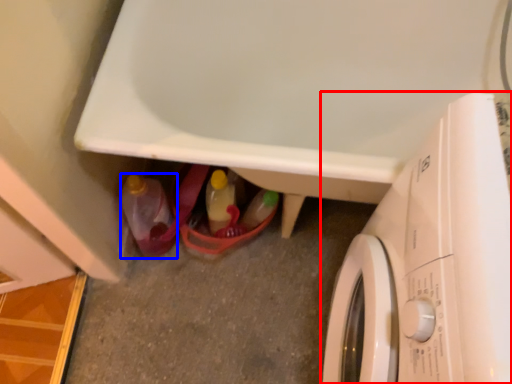
Question: Which point is further to the camera, washing machine (highlighted by a red box) or bottle (highlighted by a blue box)?

Choices:
 (A) washing machine
 (B) bottle

Answer: (B)